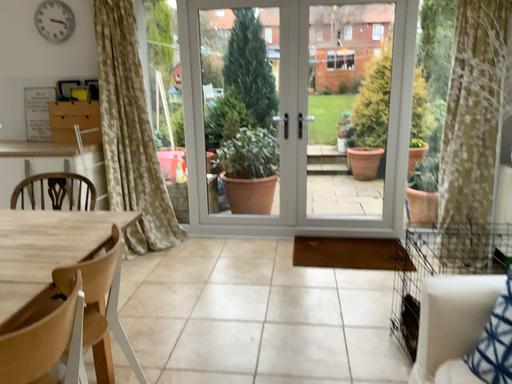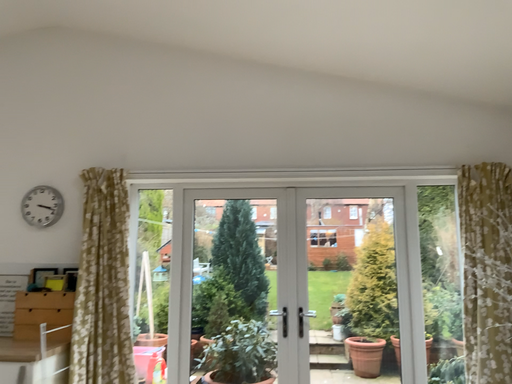
Question: How did the camera likely rotate when shooting the video?

Choices:
 (A) rotated downward
 (B) rotated upward

Answer: (B)